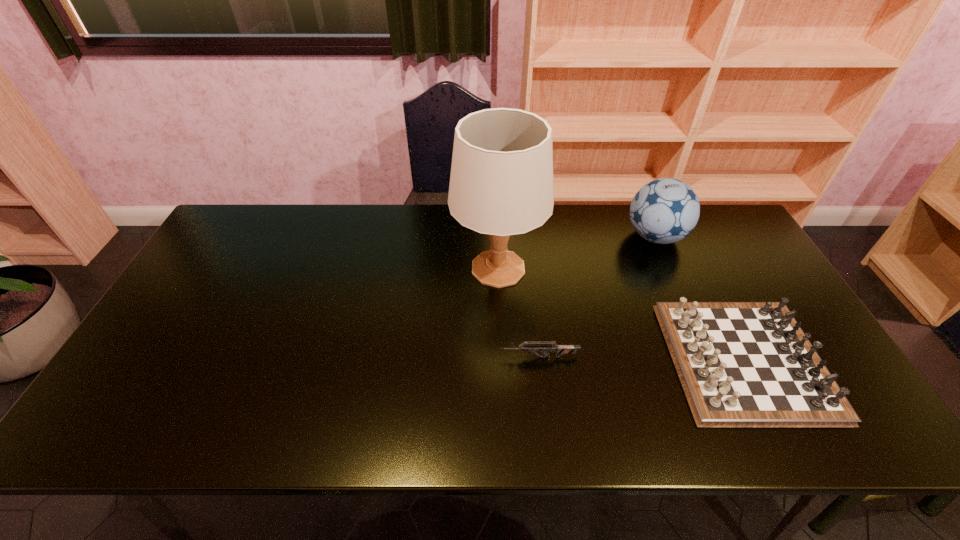
At what (x,y) coordinates should I click in order to perform the action: click on the tallest object. Please return your answer as a coordinate pair (x, y). Looking at the image, I should click on (501, 183).

Find the location of a particular element. This screenshot has height=540, width=960. soccer ball is located at coordinates (665, 210).

Image resolution: width=960 pixels, height=540 pixels. I want to click on the second shortest object, so click(x=741, y=364).

The width and height of the screenshot is (960, 540). What are the coordinates of `the shortest object` in the screenshot? It's located at (559, 349).

I want to click on vacant region located on the right of the table lamp, so click(636, 268).

You are a GUI agent. You are given a task and a screenshot of the screen. Output one action in this format:
    pyautogui.click(x=<x>, y=<y>)
    Task: Click on the free location located on the side with brand of the soccer ball
    
    Given the screenshot: What is the action you would take?
    pyautogui.click(x=517, y=237)

Locate an element on the screen. This screenshot has height=540, width=960. vacant space located 0.340m on the side with brand of the soccer ball is located at coordinates 520,237.

Find the location of a particular element. Image resolution: width=960 pixels, height=540 pixels. vacant space situated 0.320m on the side with brand of the soccer ball is located at coordinates (527, 237).

I want to click on free space located from the player's perspective of the chessboard, so click(593, 360).

Locate an element on the screen. The image size is (960, 540). vacant space situated 0.360m from the player's perspective of the chessboard is located at coordinates (529, 360).